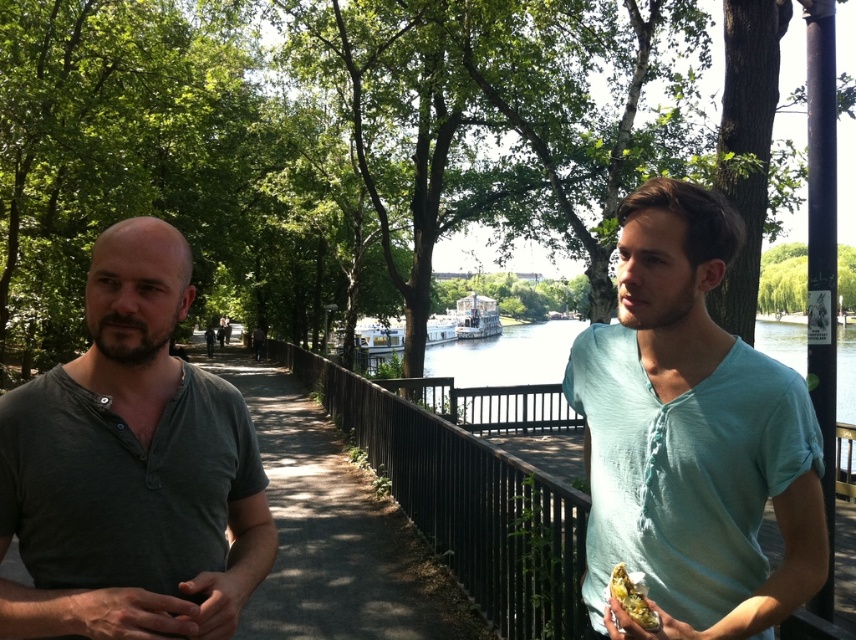
Does point (575, 570) lie in front of point (617, 621)?

No, it is behind (617, 621).

Measure the distance from black metal fence at center to matte yellow food at lower right.

black metal fence at center and matte yellow food at lower right are 6.11 meters apart from each other.

What are the coordinates of `black metal fence at center` in the screenshot? It's located at (468, 484).

Between shiny foil food at right and matte yellow food at lower right, which one appears on the left side from the viewer's perspective?

Positioned to the left is shiny foil food at right.

Is shiny foil food at right above matte yellow food at lower right?

Indeed, shiny foil food at right is positioned over matte yellow food at lower right.

Who is more forward, (651, 625) or (607, 627)?

Positioned in front is point (651, 625).

Where is `shiny foil food at right`? This screenshot has height=640, width=856. shiny foil food at right is located at coordinates (632, 596).

Is light blue cotton shirt at right to the right of matte yellow food at lower right from the viewer's perspective?

Correct, you'll find light blue cotton shirt at right to the right of matte yellow food at lower right.

Does light blue cotton shirt at right have a larger size compared to matte yellow food at lower right?

Correct, light blue cotton shirt at right is larger in size than matte yellow food at lower right.

What do you see at coordinates (693, 433) in the screenshot? I see `light blue cotton shirt at right` at bounding box center [693, 433].

The width and height of the screenshot is (856, 640). In order to click on light blue cotton shirt at right in this screenshot , I will do `click(693, 433)`.